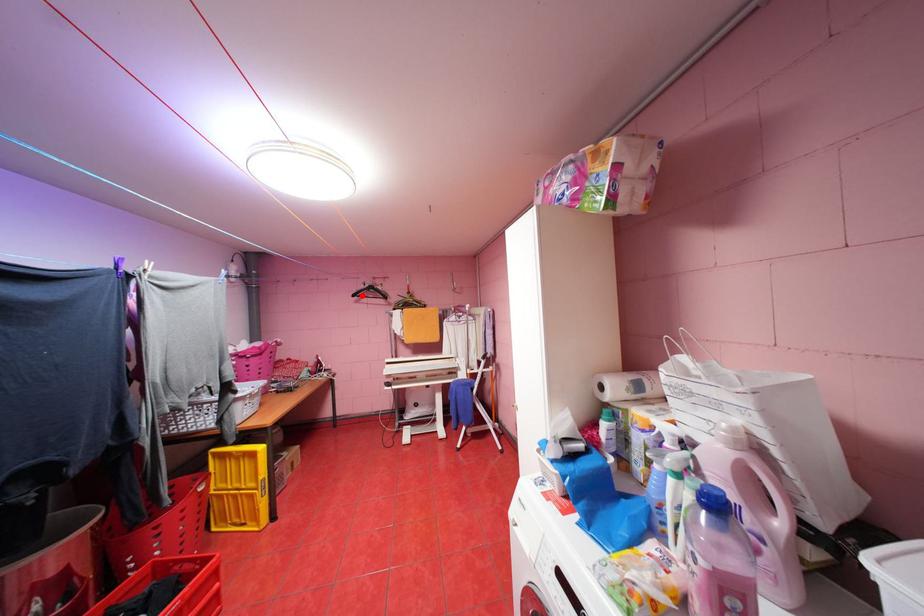
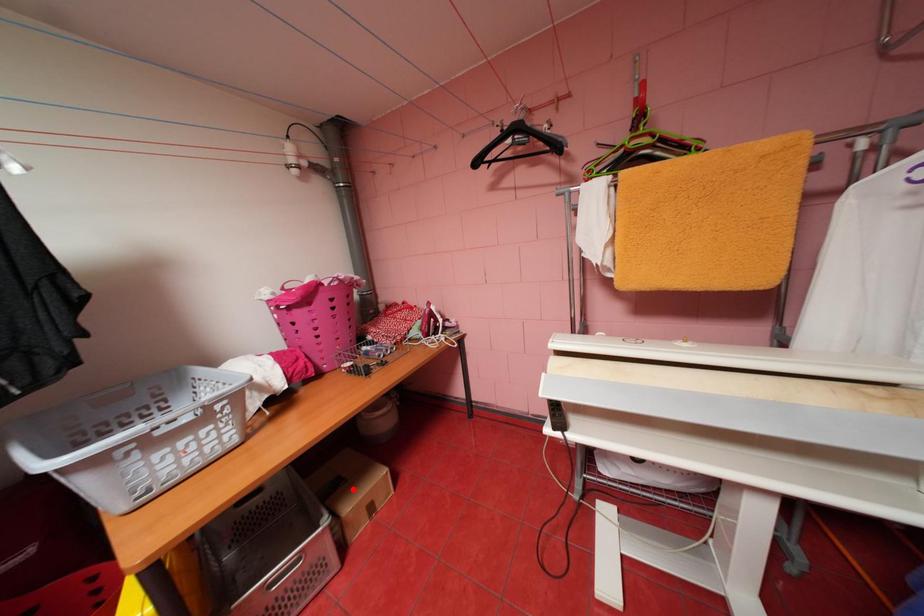
I am providing you with two images of the same scene from different viewpoints. A red point is marked on the first image and another point is marked on the second image. Is the red point in image1 aligned with the point shown in image2?

No